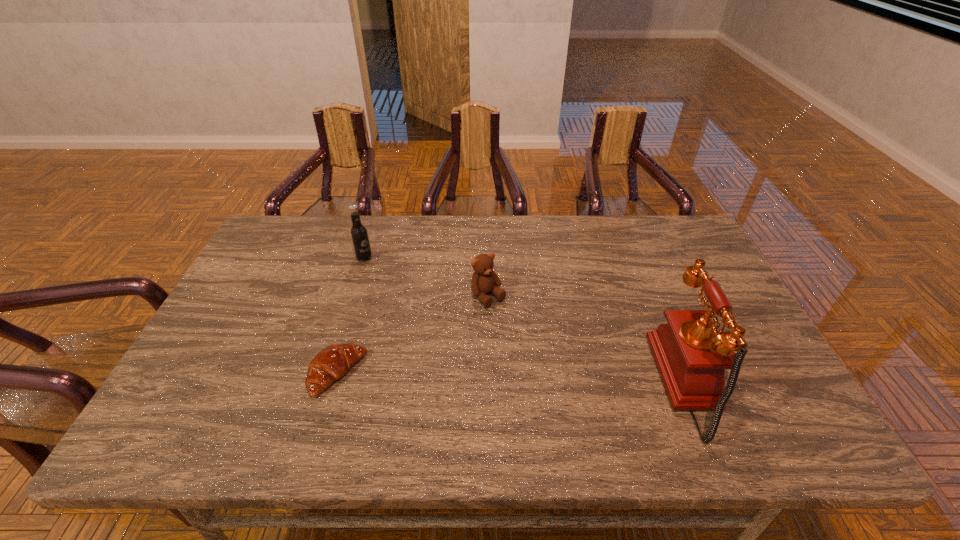
You are a GUI agent. You are given a task and a screenshot of the screen. Output one action in this format:
    pyautogui.click(x=<x>, y=<y>)
    Task: Click on the blank area located 0.070m on the face of the third nearest object
    The image size is (960, 540).
    Given the screenshot: What is the action you would take?
    pyautogui.click(x=513, y=323)

Where is `vacant space located 0.370m on the face of the third nearest object`? The image size is (960, 540). vacant space located 0.370m on the face of the third nearest object is located at coordinates (589, 407).

Where is `free space located on the label of the root beer`? The image size is (960, 540). free space located on the label of the root beer is located at coordinates (459, 320).

In order to click on vacant space located 0.270m on the label of the root beer in this screenshot , I will do `click(430, 301)`.

The height and width of the screenshot is (540, 960). In order to click on blank space located 0.190m on the label of the root beer in this screenshot , I will do `click(411, 288)`.

What are the coordinates of `object situated at the far edge` in the screenshot? It's located at (359, 235).

Image resolution: width=960 pixels, height=540 pixels. Identify the location of crescent roll located in the near edge section of the desktop. (330, 364).

This screenshot has width=960, height=540. I want to click on telephone positioned at the near edge, so click(691, 355).

Image resolution: width=960 pixels, height=540 pixels. What are the coordinates of `object that is at the right edge` in the screenshot? It's located at (691, 355).

At what (x,y) coordinates should I click in order to perform the action: click on object that is positioned at the near right corner. Please return your answer as a coordinate pair (x, y). This screenshot has width=960, height=540. Looking at the image, I should click on (691, 355).